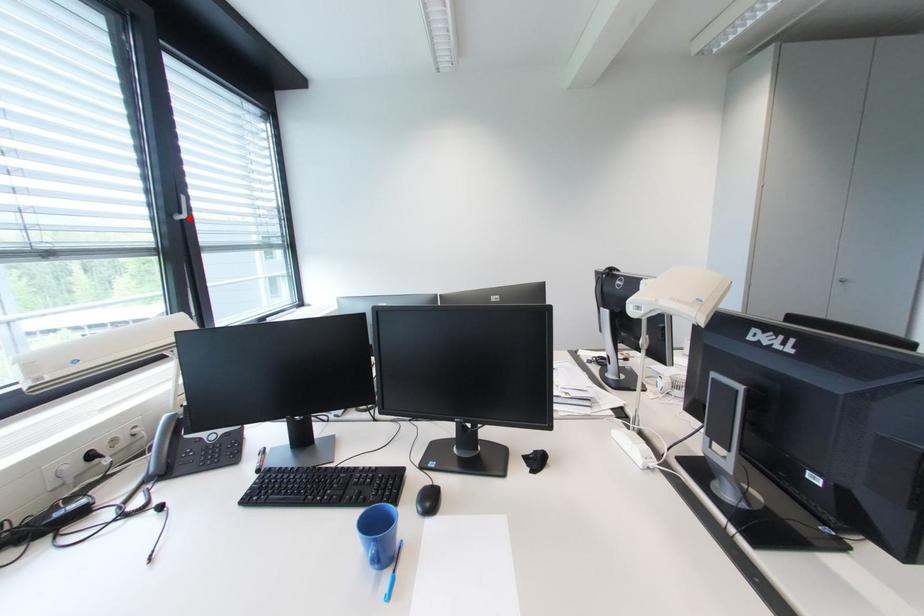
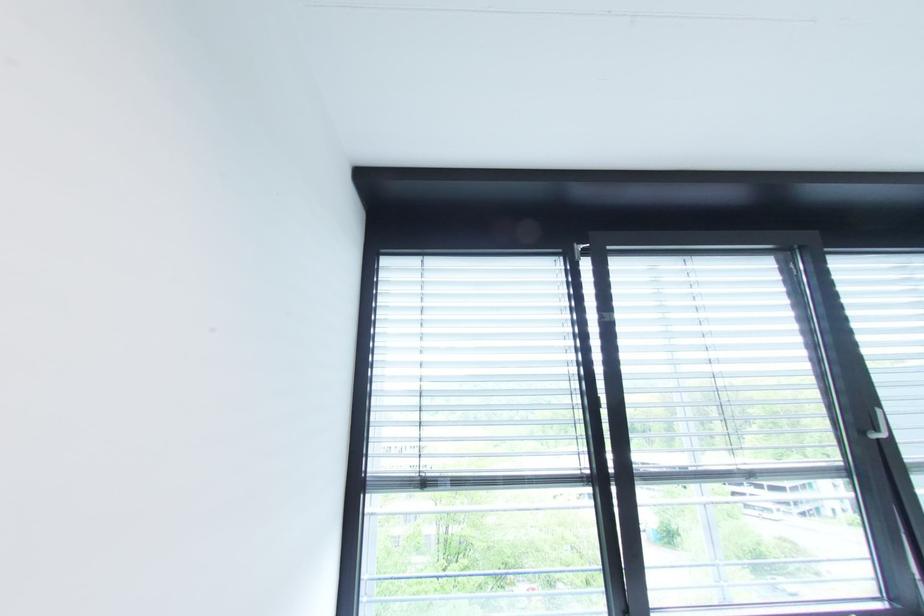
Where in the second image is the point corresponding to the highlighted location from the first image?

(889, 437)